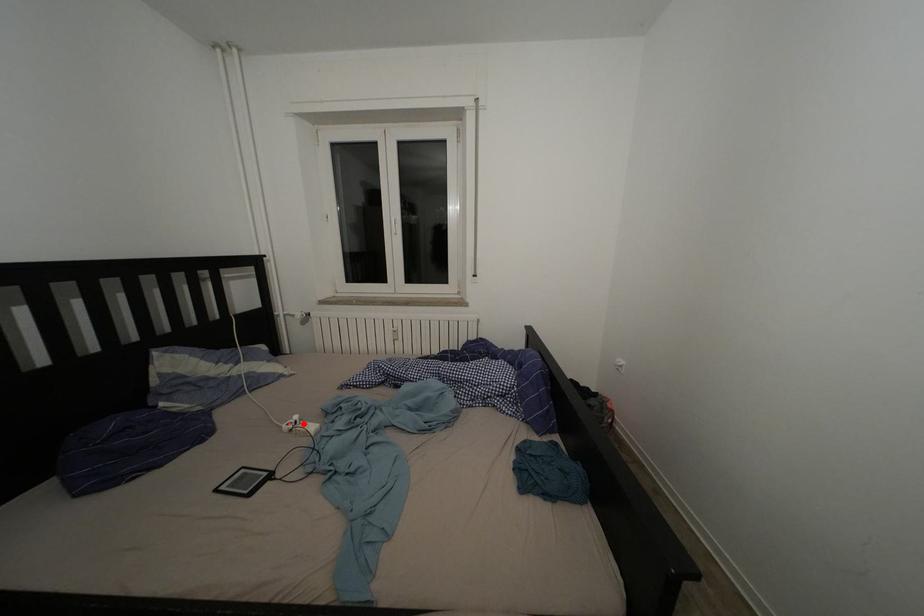
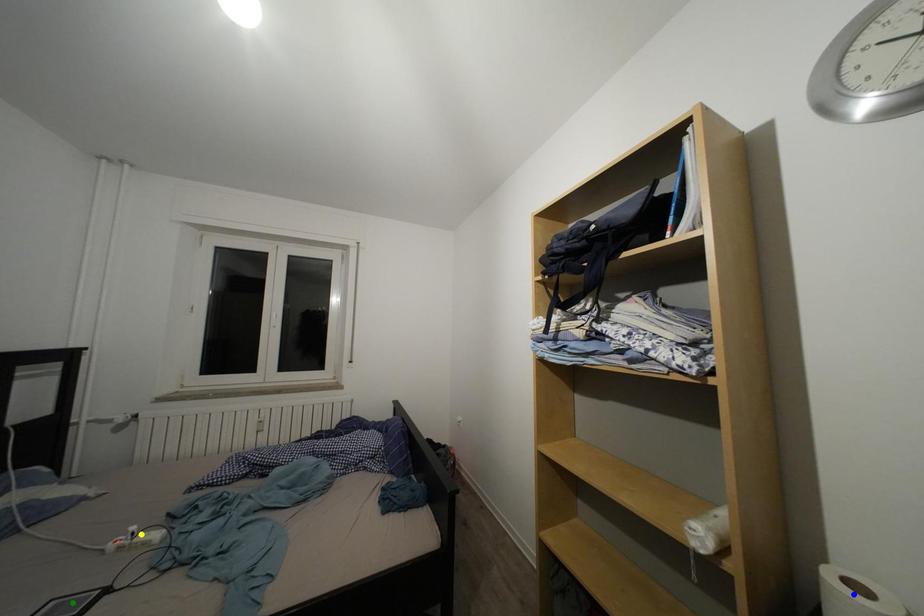
Question: I am providing you with two images of the same scene from different viewpoints. A red point is marked on the first image. You are given multiple points on the second image. Which mark in image 2 goes with the point in image 1?

Choices:
 (A) yellow point
 (B) blue point
 (C) green point

Answer: (A)